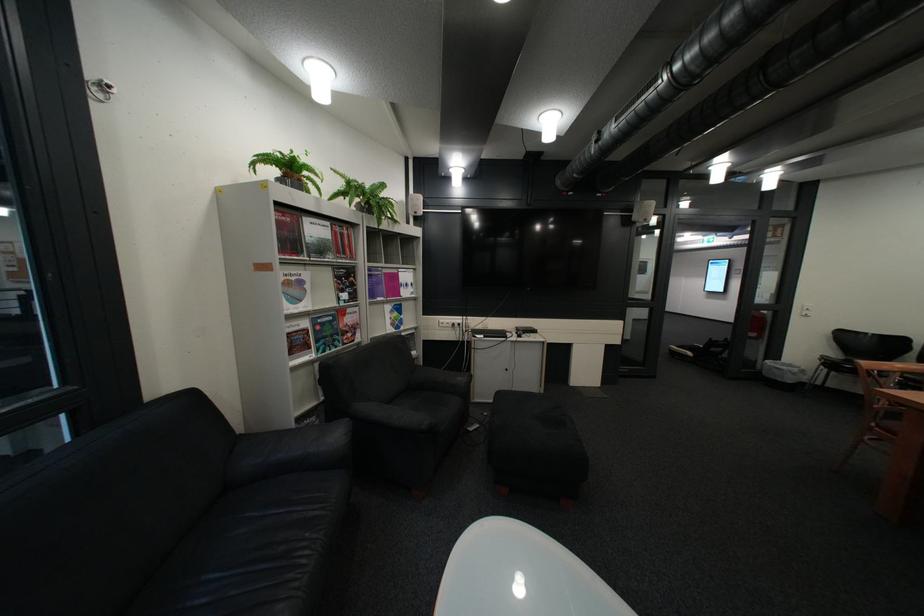
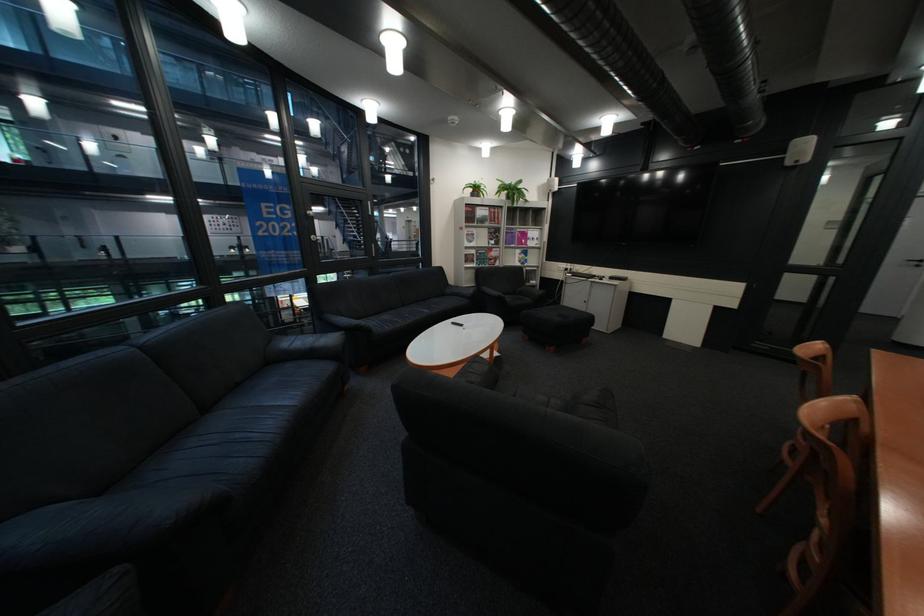
Find the pixel in the second image that matches [323,268] in the first image.

(492, 229)